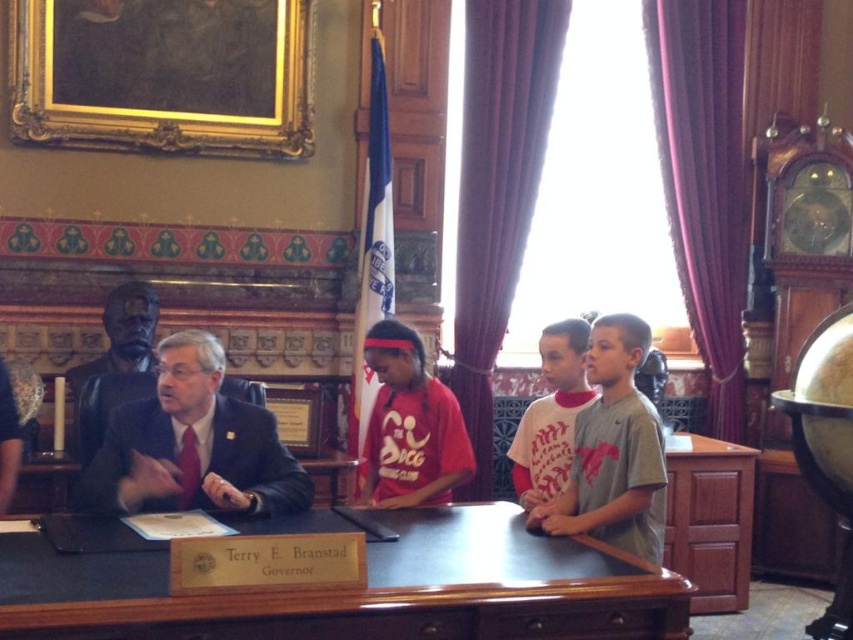
Question: Can you confirm if black leather table at center is positioned above white cotton shirt at center?

Choices:
 (A) yes
 (B) no

Answer: (B)

Question: Which object appears closest to the camera in this image?

Choices:
 (A) dark suit at center
 (B) white cotton shirt at center
 (C) black leather table at center
 (D) red cotton shirt at center

Answer: (C)

Question: Which of the following is the closest to the observer?

Choices:
 (A) dark suit at center
 (B) black leather table at center

Answer: (B)

Question: Is black leather table at center positioned at the back of red cotton shirt at center?

Choices:
 (A) no
 (B) yes

Answer: (A)

Question: Is dark suit at center bigger than red cotton shirt at center?

Choices:
 (A) no
 (B) yes

Answer: (A)

Question: Which point is farther from the camera taking this photo?

Choices:
 (A) (548, 337)
 (B) (610, 524)

Answer: (A)